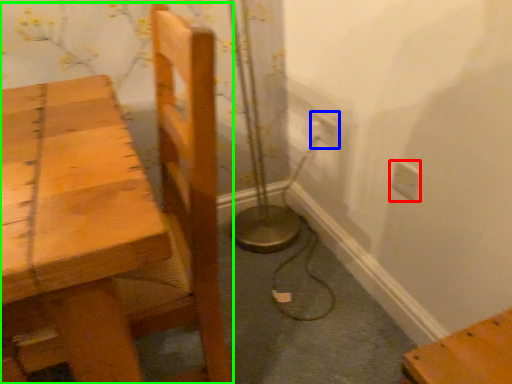
Question: Which is nearer to the electric outlet (highlighted by a red box)? electric outlet (highlighted by a blue box) or chair (highlighted by a green box).

Choices:
 (A) electric outlet
 (B) chair

Answer: (A)